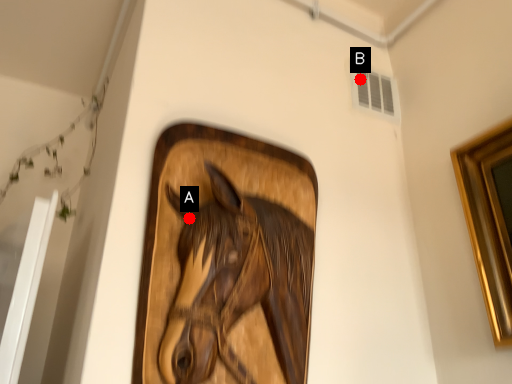
Question: Two points are circled on the image, labeled by A and B beside each circle. Which point appears farthest from the camera in this image?

Choices:
 (A) A is further
 (B) B is further

Answer: (B)